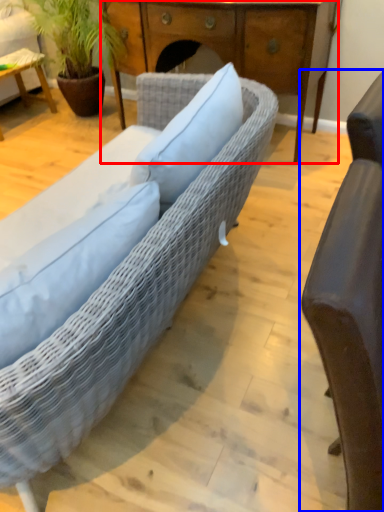
Question: Which point is further to the camera, desk (highlighted by a red box) or chair (highlighted by a blue box)?

Choices:
 (A) desk
 (B) chair

Answer: (A)